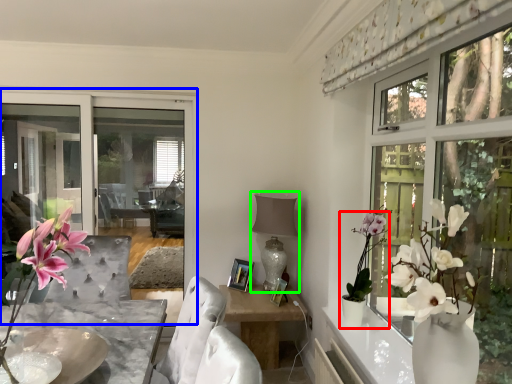
Question: Which object is positioned closest to houseplant (highlighted by a red box)? Select from window screen (highlighted by a blue box) and lamp (highlighted by a green box).

Choices:
 (A) window screen
 (B) lamp

Answer: (B)